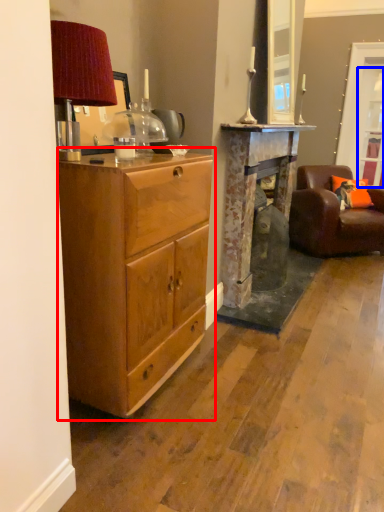
Question: Which object appears closest to the camera in this image, cabinetry (highlighted by a red box) or glass door (highlighted by a blue box)?

Choices:
 (A) cabinetry
 (B) glass door

Answer: (A)